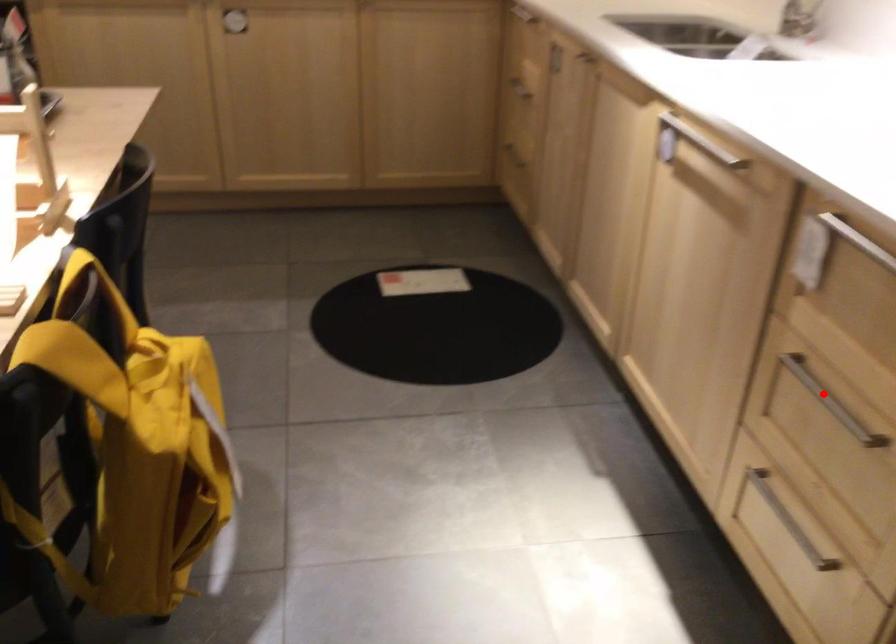
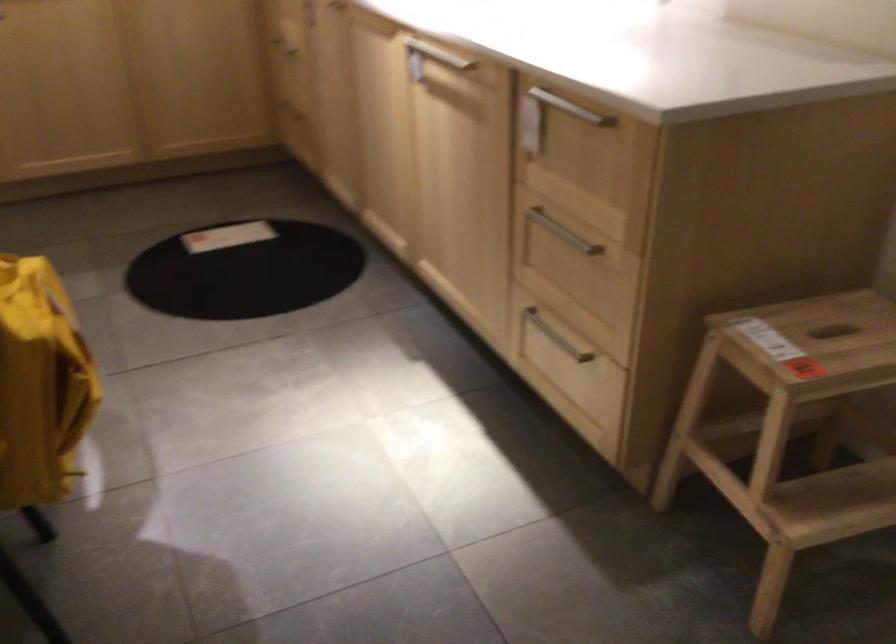
Question: I am providing you with two images of the same scene from different viewpoints. In image1, a red point is highlighted. Considering the same 3D point in image2, which of the following is correct?

Choices:
 (A) It is closer
 (B) It is farther

Answer: (B)